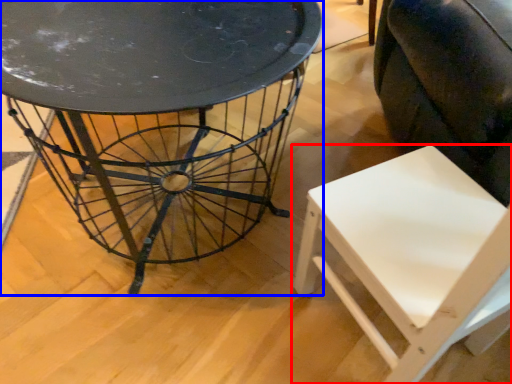
Question: Which object is closer to the camera taking this photo, chair (highlighted by a red box) or table (highlighted by a blue box)?

Choices:
 (A) chair
 (B) table

Answer: (A)